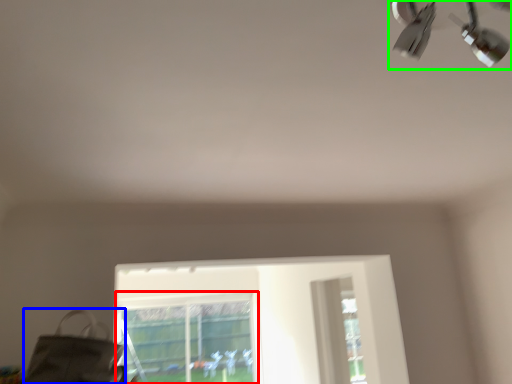
Question: Estimate the real-world distances between objects in this image. Which object is closer to bay window (highlighted by a red box), messenger bag (highlighted by a blue box) or lamp (highlighted by a green box)?

Choices:
 (A) messenger bag
 (B) lamp

Answer: (A)